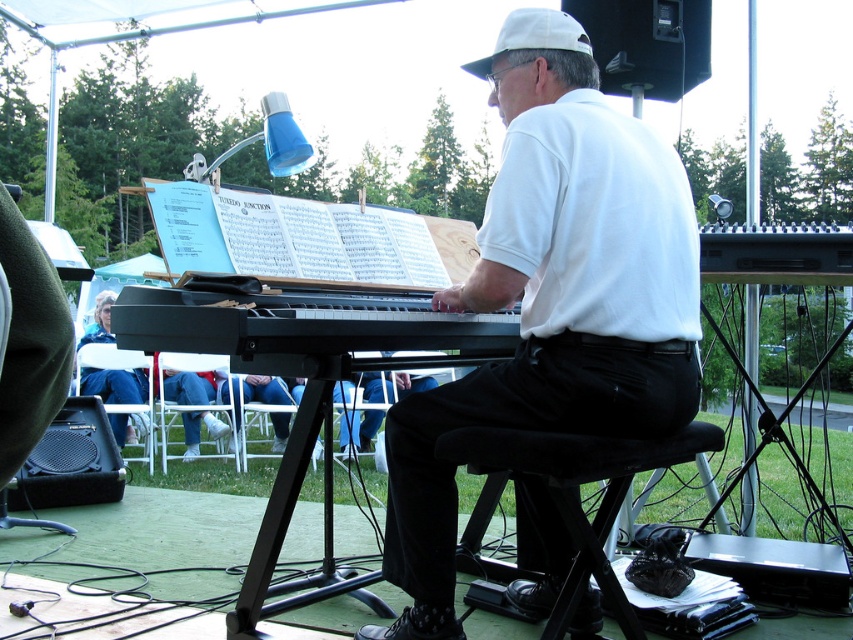
Does point (421, 570) come closer to viewer compared to point (263, 310)?

No, it is not.

Based on the photo, is white matte shirt at center above black matte keyboard at center?

Actually, white matte shirt at center is below black matte keyboard at center.

Identify the location of white matte shirt at center. This screenshot has width=853, height=640. (550, 298).

Which is above, black matte keyboard at center or black fabric stool at lower center?

Positioned higher is black matte keyboard at center.

Does black matte keyboard at center come behind black fabric stool at lower center?

Yes.

Locate an element on the screen. This screenshot has width=853, height=640. black matte keyboard at center is located at coordinates (299, 323).

This screenshot has width=853, height=640. What are the coordinates of `black matte keyboard at center` in the screenshot? It's located at (299, 323).

Between white matte shirt at center and black fabric stool at lower center, which one appears on the right side from the viewer's perspective?

Positioned to the right is black fabric stool at lower center.

Is white matte shirt at center closer to the viewer compared to black fabric stool at lower center?

That is False.

Describe the element at coordinates (550, 298) in the screenshot. The width and height of the screenshot is (853, 640). I see `white matte shirt at center` at that location.

Where is `white matte shirt at center`? Image resolution: width=853 pixels, height=640 pixels. white matte shirt at center is located at coordinates point(550,298).